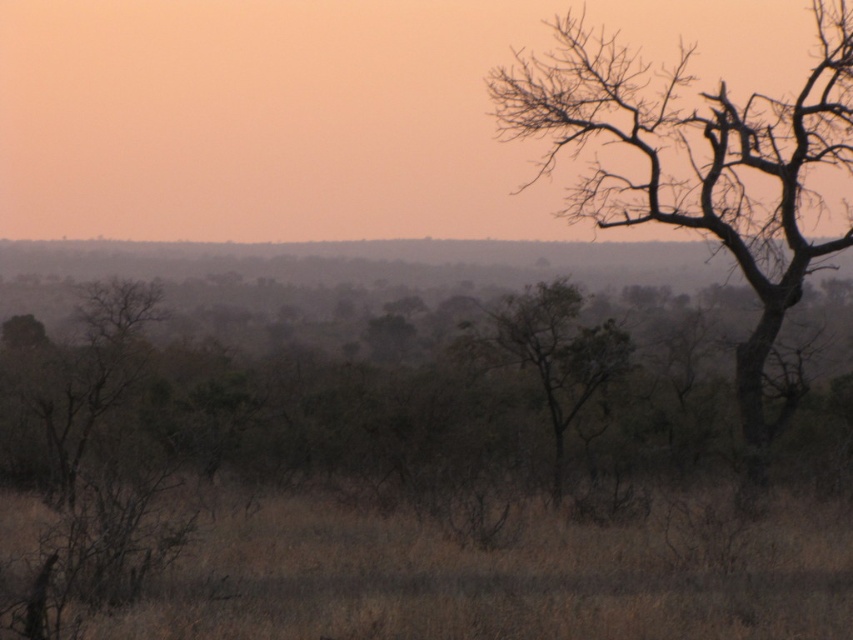
Who is positioned more to the right, brown dry grass at lower center or green leafy tree at center?

From the viewer's perspective, green leafy tree at center appears more on the right side.

In the scene shown: Can you confirm if brown dry grass at lower center is positioned above green leafy tree at center?

No, brown dry grass at lower center is not above green leafy tree at center.

Locate an element on the screen. The width and height of the screenshot is (853, 640). brown dry grass at lower center is located at coordinates (502, 577).

Find the location of a particular element. The width and height of the screenshot is (853, 640). brown dry grass at lower center is located at coordinates (502, 577).

Does brown dry grass at lower center appear over brown/dry bark tree at upper right?

Actually, brown dry grass at lower center is below brown/dry bark tree at upper right.

The height and width of the screenshot is (640, 853). In order to click on brown dry grass at lower center in this screenshot , I will do `click(502, 577)`.

Between point (795, 291) and point (490, 365), which one is positioned in front?

Point (490, 365) is in front.

Locate an element on the screen. This screenshot has width=853, height=640. brown/dry bark tree at upper right is located at coordinates (698, 164).

Find the location of `brown/dry bark tree at upper right`. brown/dry bark tree at upper right is located at coordinates (698, 164).